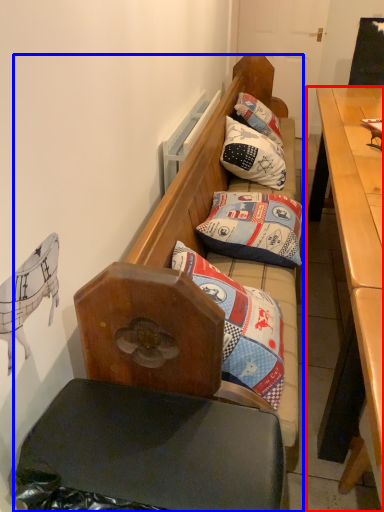
Question: Which object appears closest to the camera in this image, desk (highlighted by a red box) or studio couch (highlighted by a blue box)?

Choices:
 (A) desk
 (B) studio couch

Answer: (A)